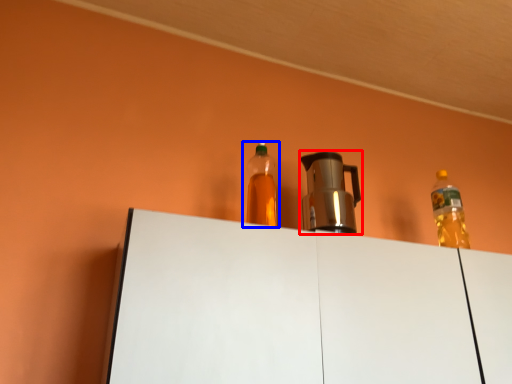
Question: Which point is closer to the camera, coffeepot (highlighted by a red box) or bottle (highlighted by a blue box)?

Choices:
 (A) coffeepot
 (B) bottle

Answer: (B)